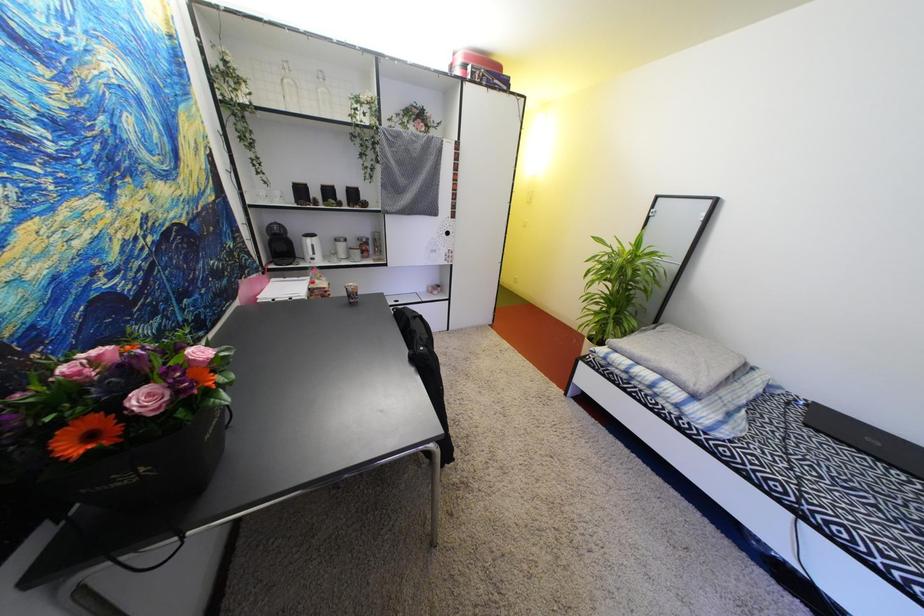
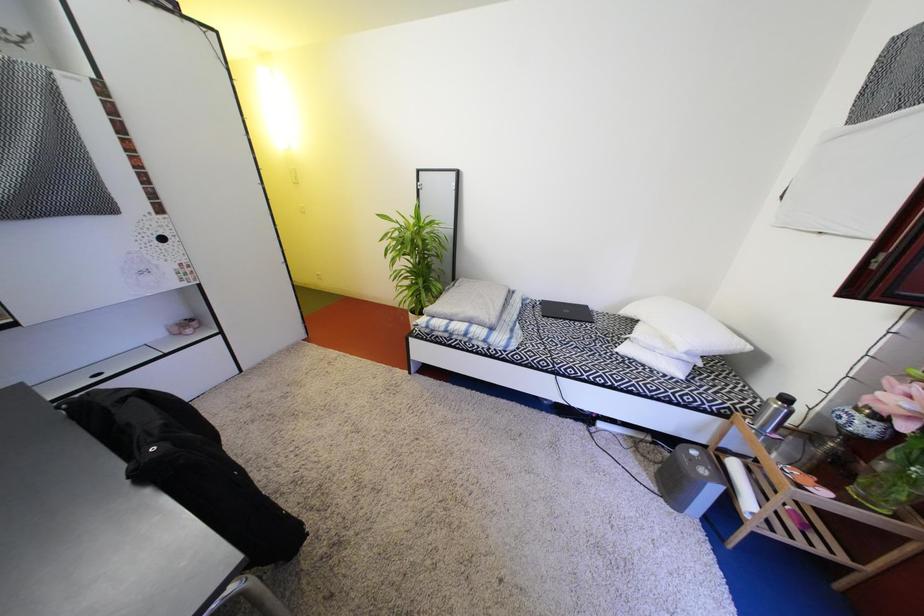
Question: How did the camera likely rotate?

Choices:
 (A) Left
 (B) Right
 (C) Up
 (D) Down

Answer: (B)